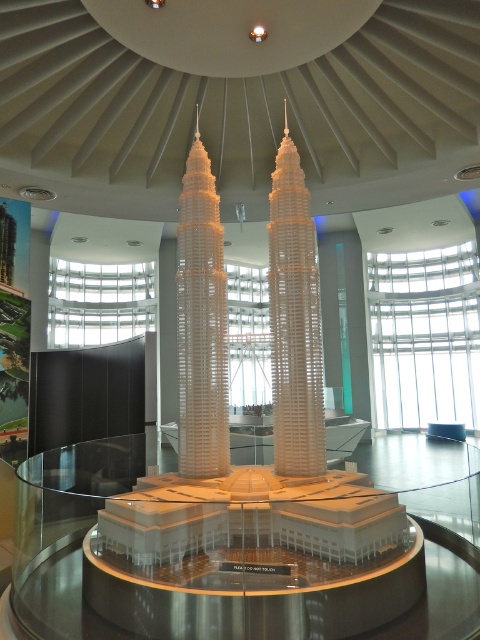
Does white plastic tower at center have a lesser width compared to white plastic building at center?

Indeed, white plastic tower at center has a lesser width compared to white plastic building at center.

Based on the photo, does white plastic tower at center appear under white plastic building at center?

No, white plastic tower at center is not below white plastic building at center.

Which is in front, point (273, 401) or point (204, 177)?

Point (273, 401) is more forward.

Identify the location of white plastic tower at center. click(x=295, y=321).